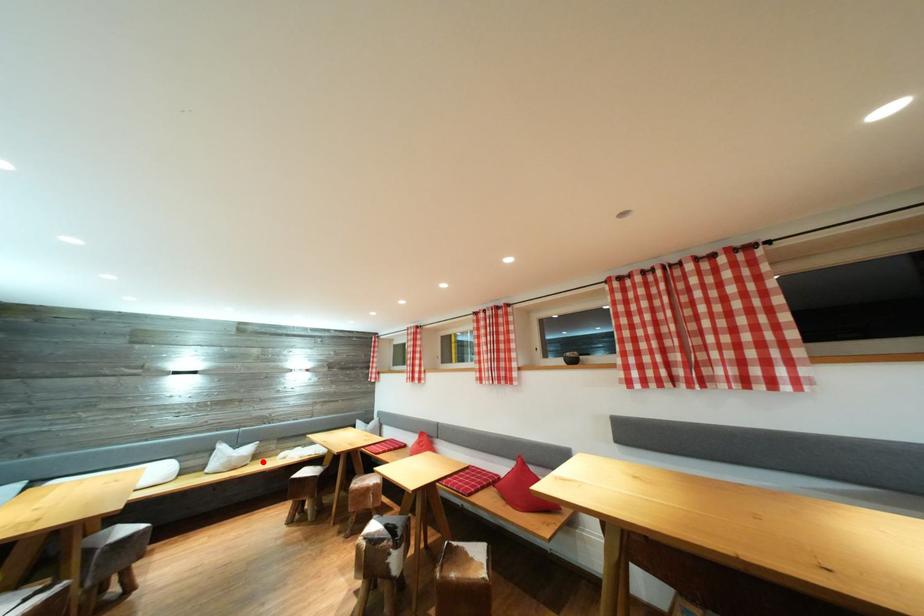
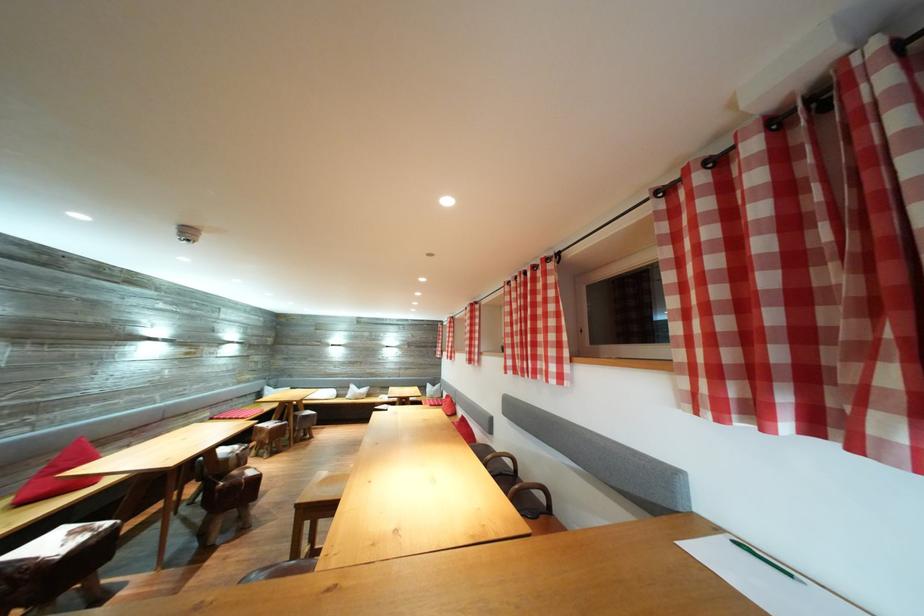
Question: I am providing you with two images of the same scene from different viewpoints. Image1 has a red point marked. In image2, the corresponding 3D location appears at what relative position? Reply with the corresponding letter.

Choices:
 (A) Closer
 (B) Farther

Answer: (B)